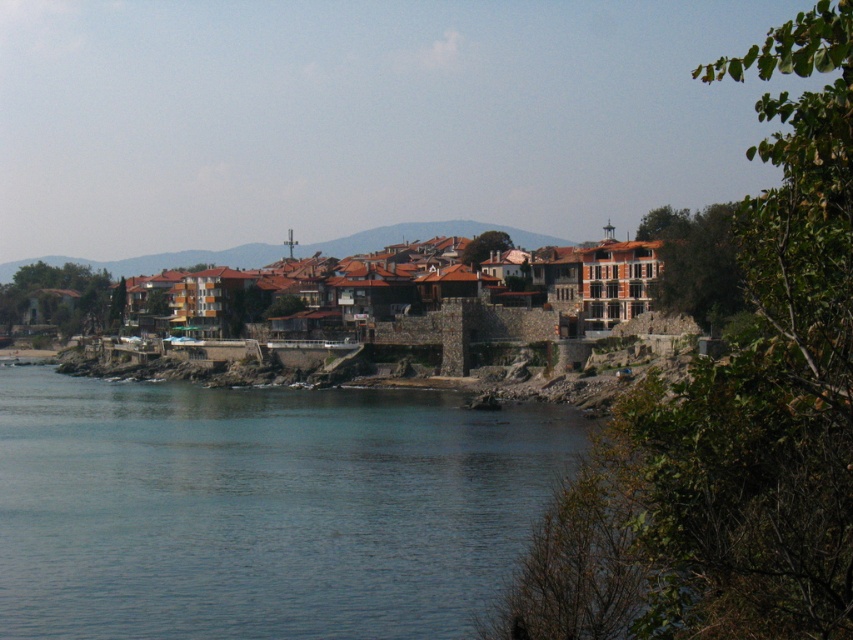
You are a tourist standing on the cliff overlooking the coastal town. You notice two features at the center of the scene. Which one is wider in terms of horizontal spread? The brown stone buildings at center or the brown tiled roofs at center?

The brown tiled roofs at center are wider than the brown stone buildings at center, so the brown tiled roofs at center have a wider horizontal spread.

You are standing at the edge of the cliff overlooking the town. You notice the blue water at lower left and the brown tiled roofs at center. Which of these two elements is positioned lower in the image?

The blue water at lower left is positioned lower than the brown tiled roofs at center in the image.

Based on the provided scene description, where are the brown stone buildings at center located in terms of their 2D coordinates?

The brown stone buildings at center are located at the 2D coordinates of point (190, 259).